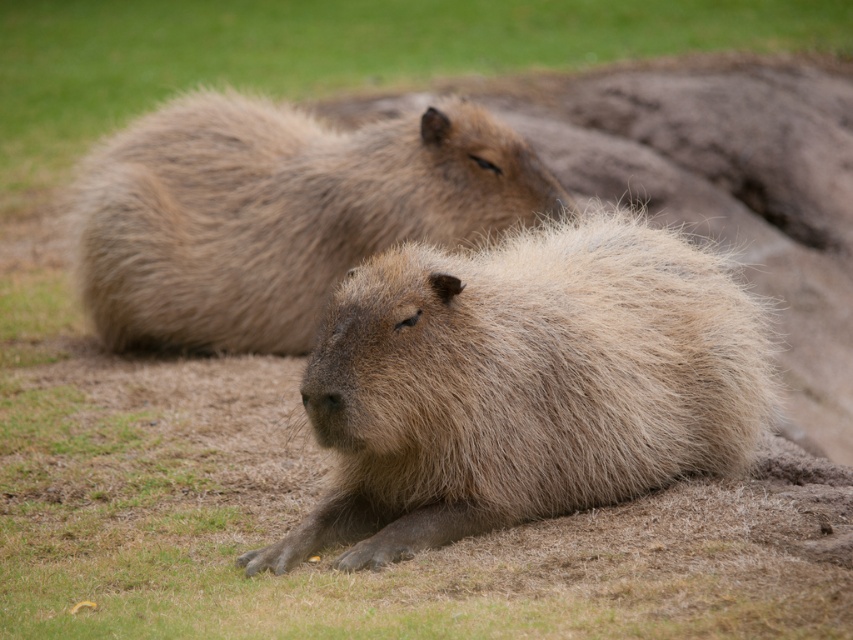
Question: Among these points, which one is nearest to the camera?

Choices:
 (A) (401, 225)
 (B) (671, 300)

Answer: (B)

Question: Does brown fuzzy capybara at center appear under brown fuzzy capybara at upper center?

Choices:
 (A) no
 (B) yes

Answer: (B)

Question: Does brown fuzzy capybara at center appear on the right side of brown fuzzy capybara at upper center?

Choices:
 (A) yes
 (B) no

Answer: (A)

Question: Which point is farther to the camera?

Choices:
 (A) (154, 136)
 (B) (407, 454)

Answer: (A)

Question: Can you confirm if brown fuzzy capybara at center is wider than brown fuzzy capybara at upper center?

Choices:
 (A) no
 (B) yes

Answer: (A)

Question: Which object appears farthest from the camera in this image?

Choices:
 (A) brown fuzzy capybara at upper center
 (B) brown fuzzy capybara at center

Answer: (A)